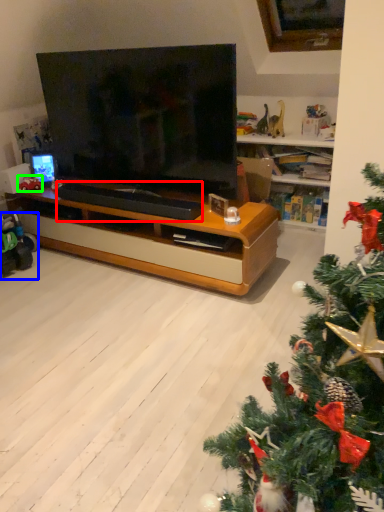
Question: Considering the real-world distances, which object is closest to footrest (highlighted by a red box)? toy (highlighted by a blue box) or toy (highlighted by a green box).

Choices:
 (A) toy
 (B) toy

Answer: (A)